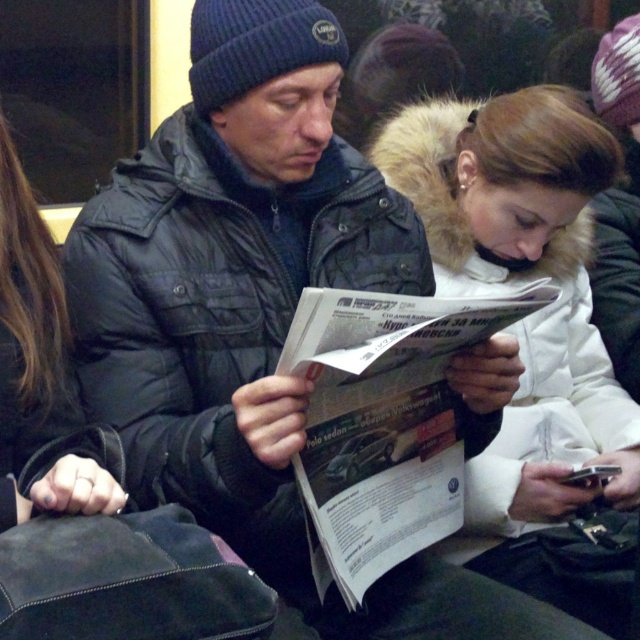
Question: Does white fur coat at center have a greater width compared to black leather jacket at center?

Choices:
 (A) yes
 (B) no

Answer: (A)

Question: Does white fur coat at center appear on the left side of black leather jacket at center?

Choices:
 (A) no
 (B) yes

Answer: (A)

Question: Which point appears closest to the camera in this image?

Choices:
 (A) (506, 168)
 (B) (29, 282)

Answer: (B)

Question: Which of the following is the farthest from the observer?

Choices:
 (A) (557, 216)
 (B) (0, 465)

Answer: (A)

Question: Can you confirm if white fur coat at center is positioned below black leather jacket at center?

Choices:
 (A) no
 (B) yes

Answer: (B)